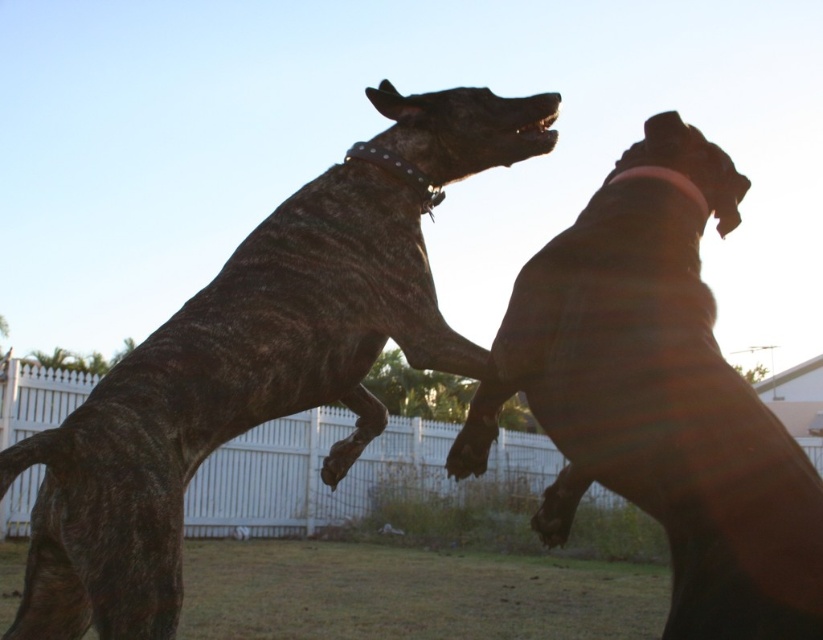
You are a photographer trying to capture a closeup of the two points in the image. Which point, point (243, 342) or point (686, 317), is closer to your camera?

Point (243, 342) is further to the camera than point (686, 317), so the closer point to the camera is point (686, 317).

From the picture: You are a photographer trying to capture a photo of the brown matte dog at upper right and the white picket fence at center. Based on their sizes in the image, which object would appear smaller in the final photo?

The brown matte dog at upper right has a lesser width compared to the white picket fence at center, so it would appear smaller in the photo.